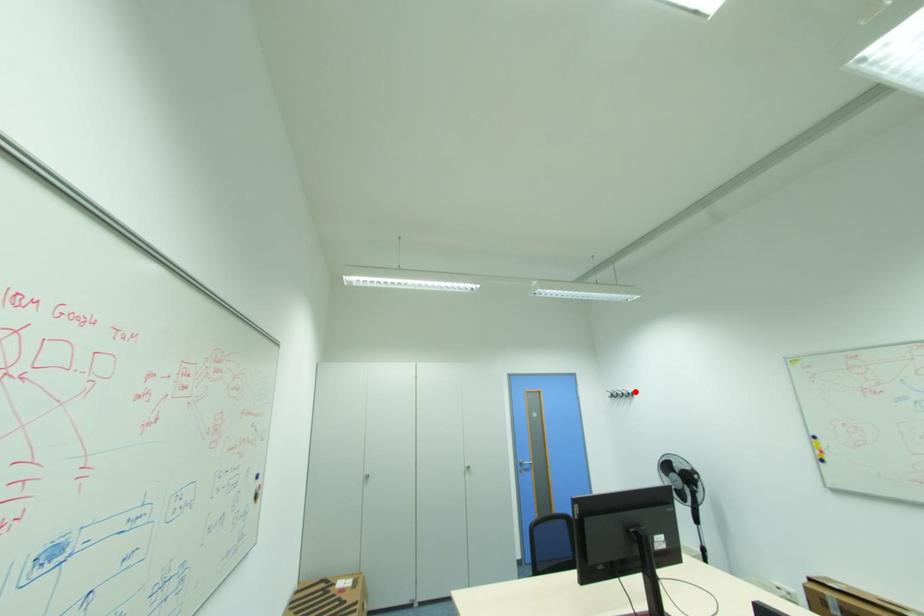
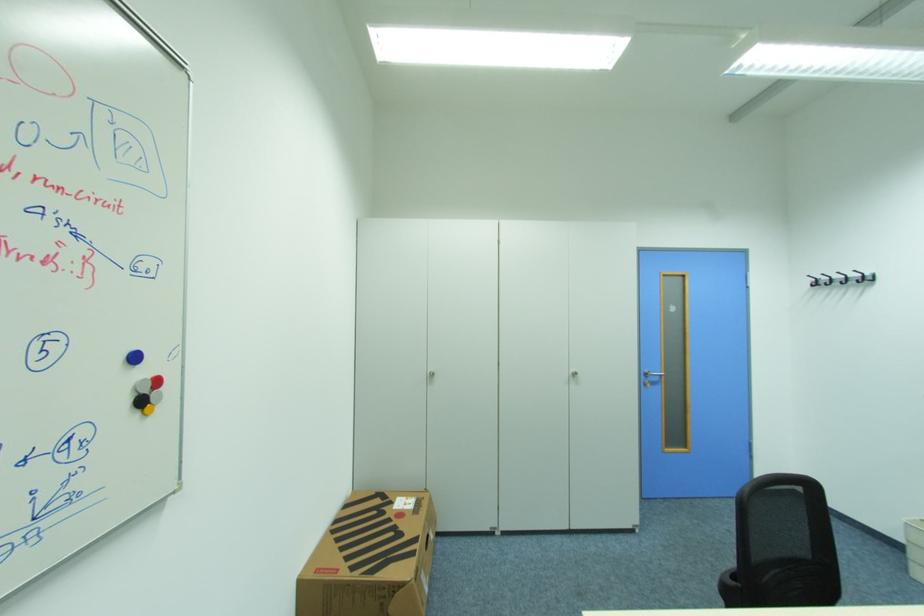
In the second image, find the point that corresponds to the highlighted location in the first image.

(872, 275)